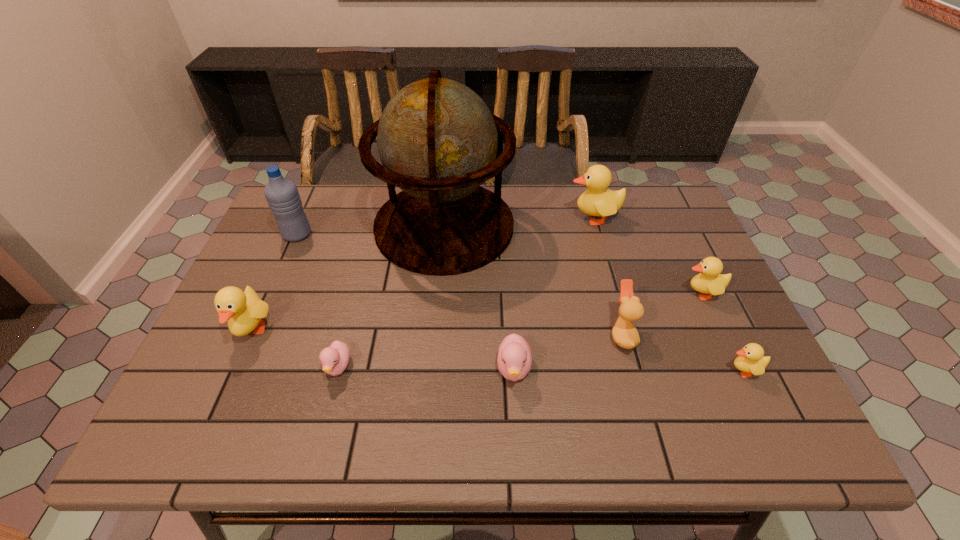
You are a GUI agent. You are given a task and a screenshot of the screen. Output one action in this format:
    pyautogui.click(x=<x>, y=<y>)
    Task: Click on the free space at the right edge of the desktop
    The height and width of the screenshot is (540, 960).
    Given the screenshot: What is the action you would take?
    pyautogui.click(x=740, y=327)

You are a GUI agent. You are given a task and a screenshot of the screen. Output one action in this format:
    pyautogui.click(x=<x>, y=<y>)
    Task: Click on the vacant space at the far right corner of the desktop
    The height and width of the screenshot is (540, 960).
    Given the screenshot: What is the action you would take?
    pyautogui.click(x=654, y=220)

The image size is (960, 540). Identify the location of vacant space in between the third biggest yellow duckling and the seventh shortest object. (647, 256).

I want to click on free space between the third yellow duckling from right to left and the tallest object, so click(518, 222).

Image resolution: width=960 pixels, height=540 pixels. In order to click on vacant space in between the third nearest yellow duckling and the duck in this screenshot , I will do `click(661, 314)`.

Where is `vacant space that's between the tan duck and the second farthest duckling`? This screenshot has width=960, height=540. vacant space that's between the tan duck and the second farthest duckling is located at coordinates [661, 314].

Where is `vacant space that is in between the third duckling from left to right and the globe`? vacant space that is in between the third duckling from left to right and the globe is located at coordinates (479, 298).

Identify the location of unoccupied area between the duck and the bigger pink duckling. This screenshot has height=540, width=960. (567, 352).

This screenshot has height=540, width=960. I want to click on empty location between the biggest yellow duckling and the left pink duckling, so click(x=466, y=293).

The image size is (960, 540). Find the location of `blank region between the third duckling from left to right and the leftmost yellow duckling`. blank region between the third duckling from left to right and the leftmost yellow duckling is located at coordinates (383, 350).